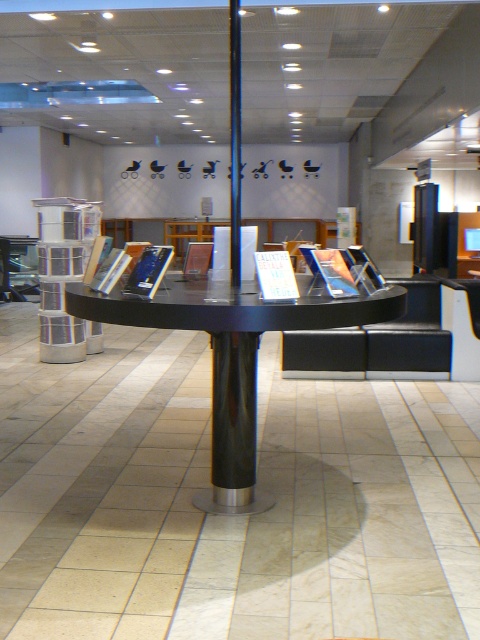
Question: Estimate the real-world distances between objects in this image. Which object is closer to the metallic cylindrical stack at left?

Choices:
 (A) black glossy pillar at center
 (B) black glossy table at center

Answer: (B)

Question: Can you confirm if black glossy table at center is positioned to the left of black glossy pillar at center?

Choices:
 (A) no
 (B) yes

Answer: (B)

Question: Is black glossy table at center above black glossy pillar at center?

Choices:
 (A) yes
 (B) no

Answer: (B)

Question: Which of the following is the farthest from the observer?

Choices:
 (A) black glossy pillar at center
 (B) metallic cylindrical stack at left

Answer: (A)

Question: Considering the real-world distances, which object is farthest from the metallic cylindrical stack at left?

Choices:
 (A) black glossy table at center
 (B) black glossy pillar at center

Answer: (B)

Question: In this image, where is metallic cylindrical stack at left located relative to black glossy pillar at center?

Choices:
 (A) below
 (B) above

Answer: (A)